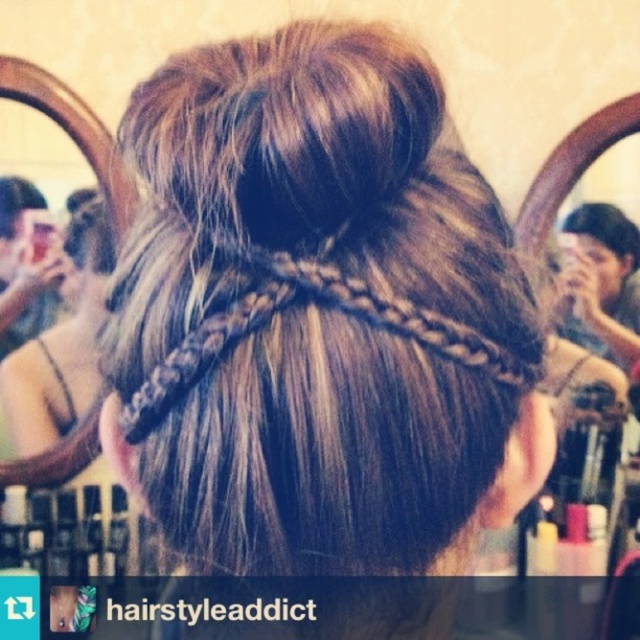
Is blonde hair at left to the right of brown silky hair at center from the viewer's perspective?

Incorrect, blonde hair at left is not on the right side of brown silky hair at center.

At what (x,y) coordinates should I click in order to perform the action: click on blonde hair at left. Please return your answer as a coordinate pair (x, y). Image resolution: width=640 pixels, height=640 pixels. Looking at the image, I should click on (61, 346).

Is dark brown silky hair at center bigger than brown silky hair at center?

Indeed, dark brown silky hair at center has a larger size compared to brown silky hair at center.

The image size is (640, 640). I want to click on dark brown silky hair at center, so click(317, 316).

Describe the element at coordinates (605, 228) in the screenshot. I see `brown silky hair at center` at that location.

Can you confirm if brown silky hair at center is thinner than brown matte hair at center?

No.

Between point (573, 227) and point (3, 193), which one is positioned in front?

Positioned in front is point (3, 193).

You are a GUI agent. You are given a task and a screenshot of the screen. Output one action in this format:
    pyautogui.click(x=<x>, y=<y>)
    Task: Click on the brown silky hair at center
    This screenshot has height=640, width=640.
    Given the screenshot: What is the action you would take?
    pyautogui.click(x=605, y=228)